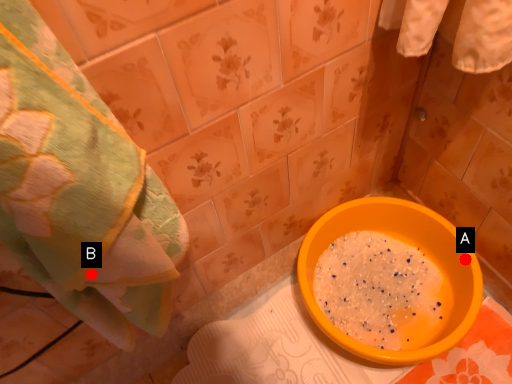
Question: Two points are circled on the image, labeled by A and B beside each circle. Which point is closer to the camera?

Choices:
 (A) A is closer
 (B) B is closer

Answer: (B)